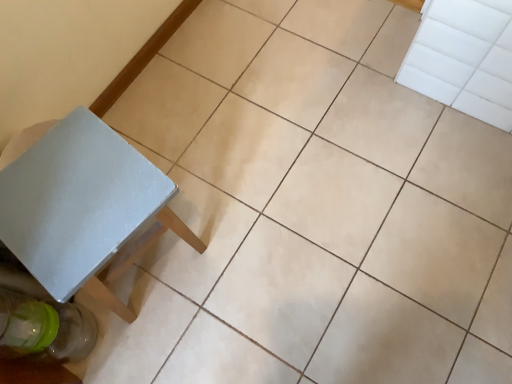
The image size is (512, 384). Identify the location of free area behind white matte table at lower left. (179, 152).